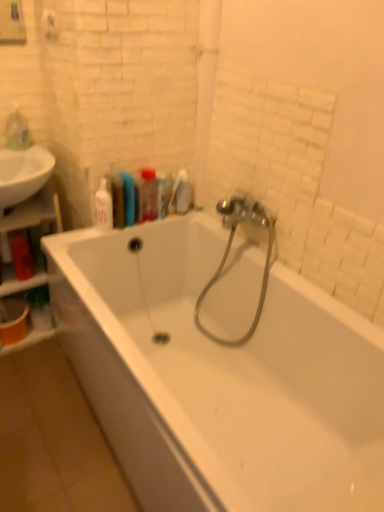
This screenshot has width=384, height=512. What are the coordinates of `vacant space situated on the left part of white glossy soap dispenser at upper left, which is the 3th toiletry from right to left` in the screenshot? It's located at (76, 232).